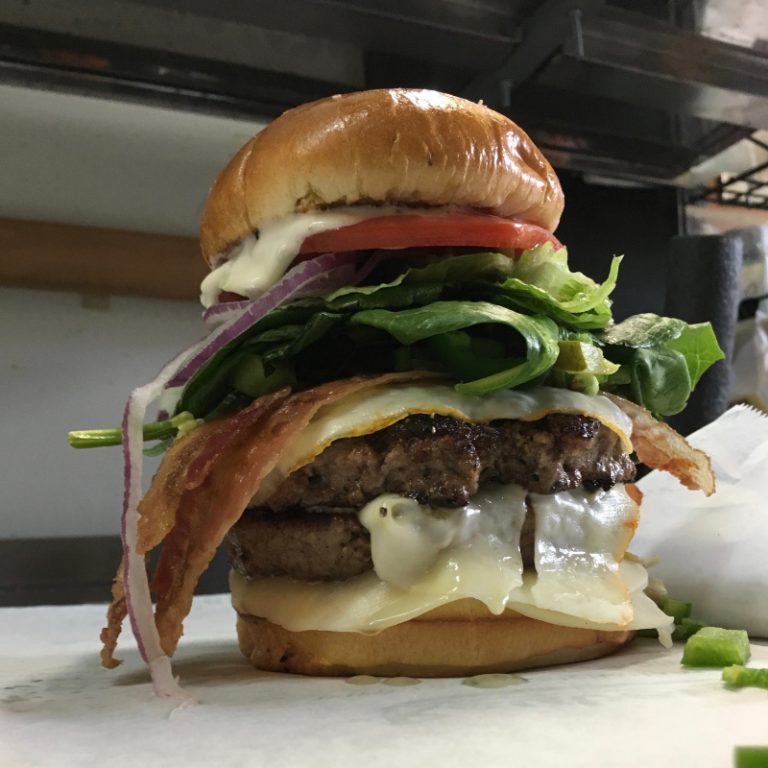
This screenshot has height=768, width=768. I want to click on table, so click(x=359, y=727).